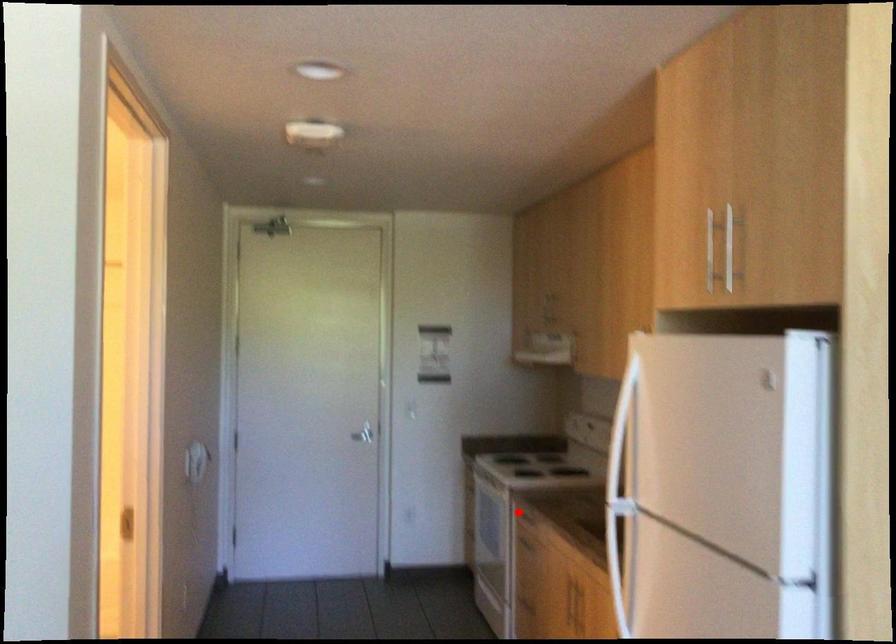
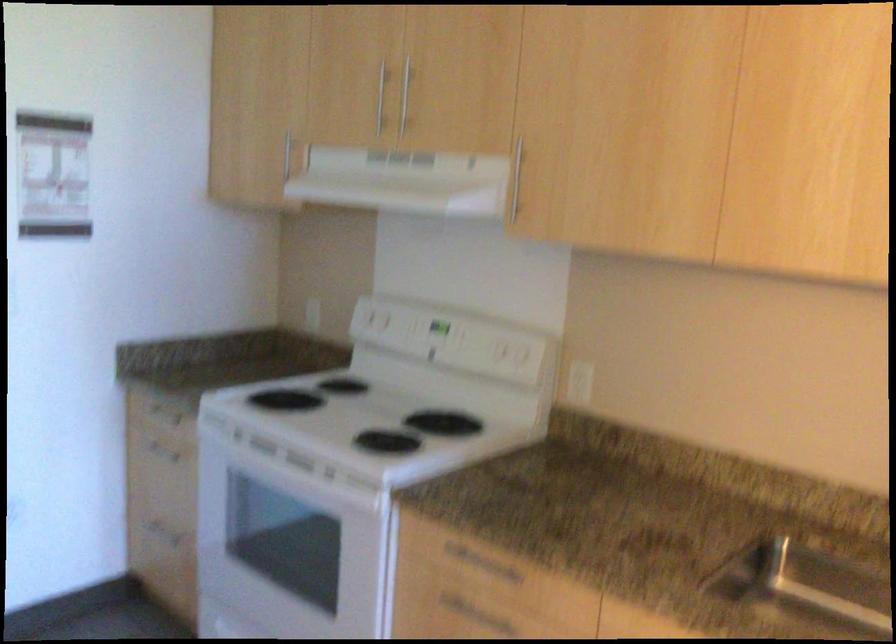
Question: I am providing you with two images of the same scene from different viewpoints. In image1, a red point is highlighted. Considering the same 3D point in image2, which of the following is correct?

Choices:
 (A) It is closer
 (B) It is farther

Answer: (A)